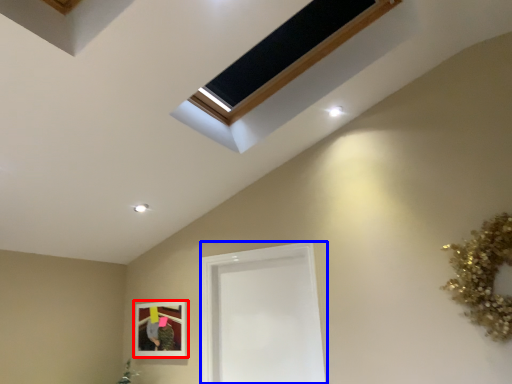
Question: Which of the following is the closest to the observer, picture frame (highlighted by a red box) or glass door (highlighted by a blue box)?

Choices:
 (A) picture frame
 (B) glass door

Answer: (B)